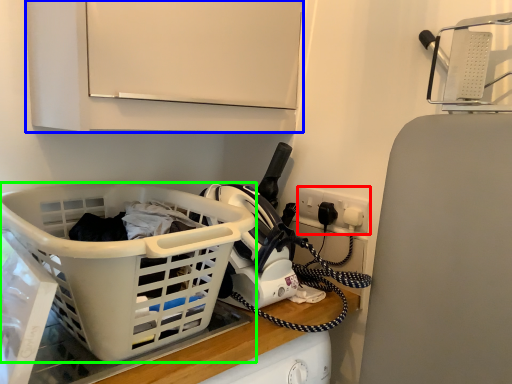
Question: Estimate the real-world distances between objects in this image. Which object is closer to electric outlet (highlighted by a red box), cabinetry (highlighted by a blue box) or basket (highlighted by a green box)?

Choices:
 (A) cabinetry
 (B) basket

Answer: (A)